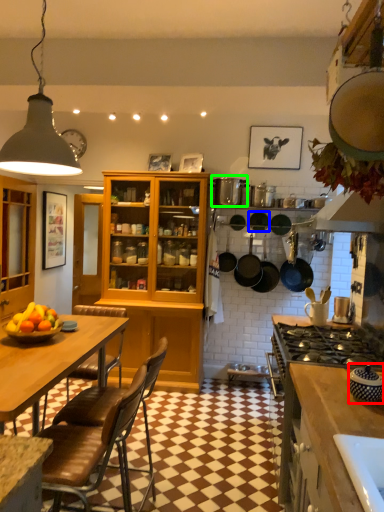
Question: Which object is the farthest from appliance (highlighted by a red box)? Choose among these: frying pan (highlighted by a blue box) or appliance (highlighted by a green box).

Choices:
 (A) frying pan
 (B) appliance

Answer: (A)